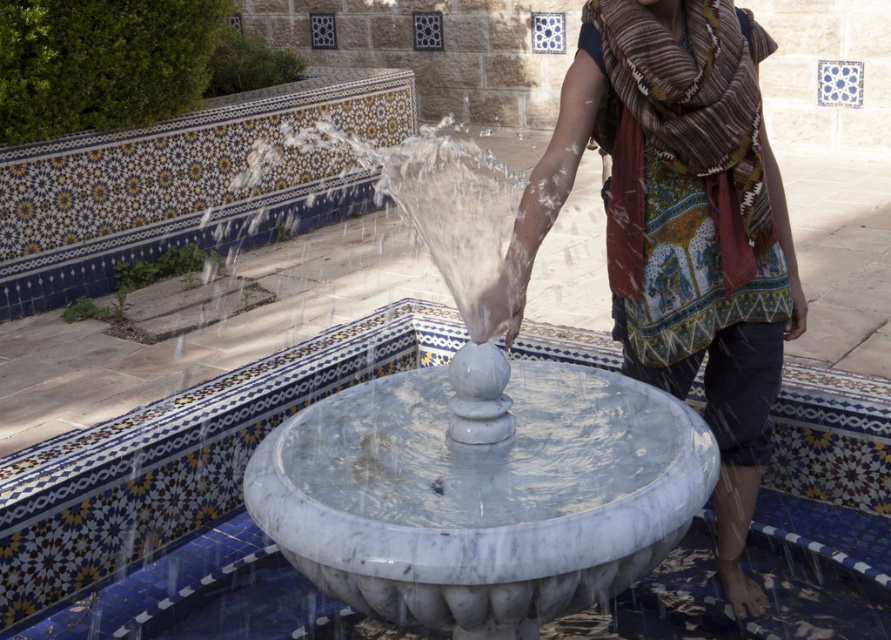
Question: Which point appears closest to the camera in this image?

Choices:
 (A) (x=677, y=136)
 (B) (x=352, y=500)

Answer: (B)

Question: Which object appears closest to the camera in this image?

Choices:
 (A) patterned scarf at center
 (B) white marble fountain at center

Answer: (B)

Question: Can you confirm if white marble fountain at center is positioned above patterned scarf at center?

Choices:
 (A) yes
 (B) no

Answer: (B)

Question: Does white marble fountain at center have a larger size compared to patterned scarf at center?

Choices:
 (A) yes
 (B) no

Answer: (B)

Question: Does white marble fountain at center have a larger size compared to patterned scarf at center?

Choices:
 (A) yes
 (B) no

Answer: (B)